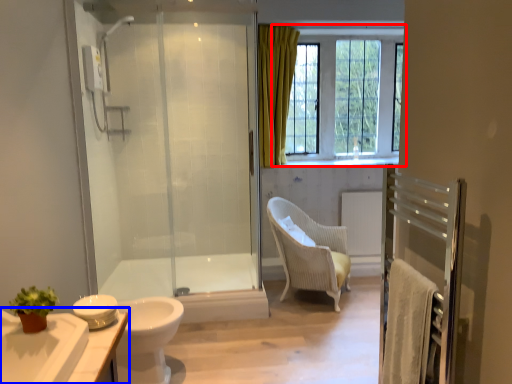
Question: Among these objects, which one is nearest to the camera, window (highlighted by a red box) or bathroom cabinet (highlighted by a blue box)?

Choices:
 (A) window
 (B) bathroom cabinet

Answer: (B)